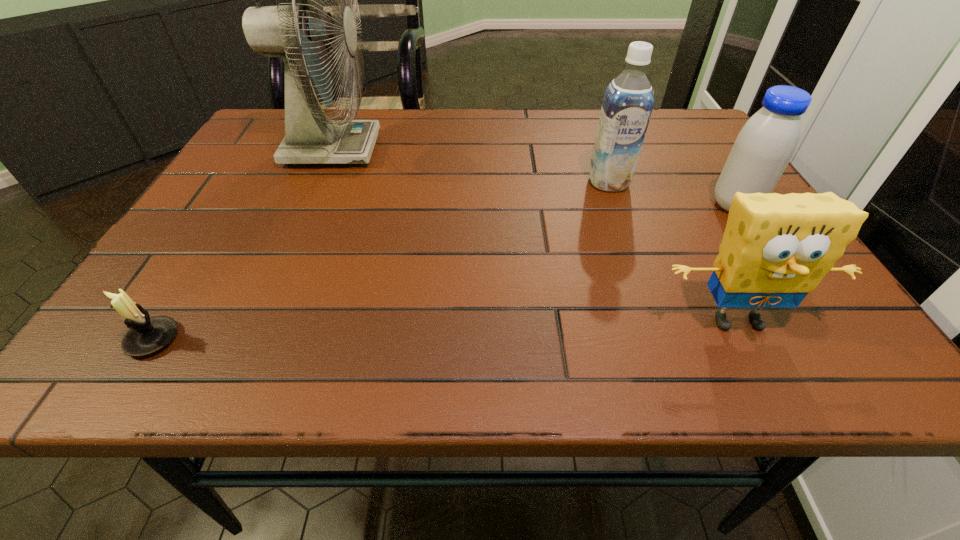
At what (x,y) coordinates should I click in order to perform the action: click on vacant space positioned 0.330m on the front of the shorter soya milk. Please return your answer as a coordinate pair (x, y). Looking at the image, I should click on (835, 357).

You are a GUI agent. You are given a task and a screenshot of the screen. Output one action in this format:
    pyautogui.click(x=<x>, y=<y>)
    Task: Click on the vacant space located 0.190m on the back of the leftmost object
    
    Given the screenshot: What is the action you would take?
    pyautogui.click(x=214, y=242)

You are a GUI agent. You are given a task and a screenshot of the screen. Output one action in this format:
    pyautogui.click(x=<x>, y=<y>)
    Task: Click on the object located at the far edge
    The image size is (960, 540).
    Given the screenshot: What is the action you would take?
    pyautogui.click(x=301, y=35)

Find the location of `sponge present at the near edge`. sponge present at the near edge is located at coordinates click(x=776, y=249).

Where is `candle holder that is positioned at the near edge`? This screenshot has height=540, width=960. candle holder that is positioned at the near edge is located at coordinates (147, 335).

Locate an element on the screen. fan that is positioned at the left edge is located at coordinates (301, 35).

You are a GUI agent. You are given a task and a screenshot of the screen. Output one action in this format:
    pyautogui.click(x=<x>, y=<y>)
    Task: Click on the candle holder present at the left edge
    This screenshot has width=960, height=540.
    Given the screenshot: What is the action you would take?
    pyautogui.click(x=147, y=335)

Image resolution: width=960 pixels, height=540 pixels. What are the coordinates of `soya milk that is at the right edge` in the screenshot? It's located at (763, 148).

Locate an element on the screen. Image resolution: width=960 pixels, height=540 pixels. sponge present at the right edge is located at coordinates (776, 249).

Locate an element on the screen. The width and height of the screenshot is (960, 540). object at the far left corner is located at coordinates (301, 35).